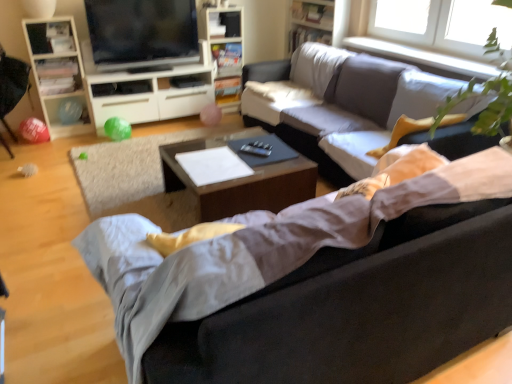
Question: Would you say wooden bookshelf at upper center, placed as the 1th bookshelf when sorted from right to left, is to the left or to the right of soft gray fabric couch at center, the second studio couch in the front-to-back sequence, in the picture?

Choices:
 (A) right
 (B) left

Answer: (B)

Question: Is wooden bookshelf at upper center, placed as the 1th bookshelf when sorted from right to left, bigger or smaller than soft gray fabric couch at center, arranged as the 1th studio couch when viewed from the back?

Choices:
 (A) big
 (B) small

Answer: (B)

Question: Which object is positioned closest to the white wood cabinet at left?

Choices:
 (A) soft gray fabric couch at center, arranged as the 1th studio couch when viewed from the back
 (B) matte white cabinet at center left
 (C) wooden bookshelf at upper center, acting as the 1th bookshelf starting from the left
 (D) matte black tv at upper left
 (E) wooden bookshelf at upper center, the second bookshelf viewed from the left

Answer: (B)

Question: Considering the real-world distances, which object is farthest from the woodenwoodencoffee table at center?

Choices:
 (A) white matte sheet at center
 (B) wooden bookshelf at upper center, marked as the 2th bookshelf in a right-to-left arrangement
 (C) white wood cabinet at left
 (D) transparent glass window at upper right
 (E) wooden bookshelf at upper center, placed as the 1th bookshelf when sorted from right to left

Answer: (E)